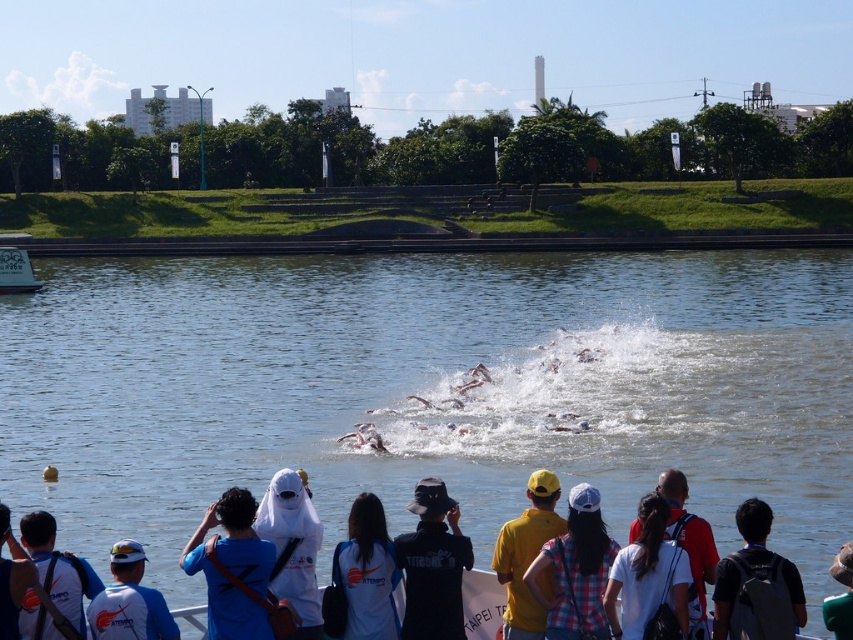
Question: Which point is farther to the camera?

Choices:
 (A) white matte shirt at center
 (B) dark gray backpack at lower right
 (C) white plastic boat at left

Answer: (C)

Question: Where is clear water at center located in relation to white fabric headscarf at lower right in the image?

Choices:
 (A) above
 (B) below

Answer: (A)

Question: Where is clear water at center located in relation to white fabric headscarf at lower right in the image?

Choices:
 (A) above
 (B) below

Answer: (A)

Question: Which is farther from the black matte hat at center?

Choices:
 (A) white matte helmet at lower left
 (B) blue fabric bag at lower left
 (C) white matte/soft fabric at center

Answer: (A)

Question: Does clear water at center have a larger size compared to blue fabric shirt at lower left?

Choices:
 (A) yes
 (B) no

Answer: (A)

Question: Which point is closer to the camera?

Choices:
 (A) (538, 612)
 (B) (25, 513)
 (C) (416, 540)

Answer: (A)